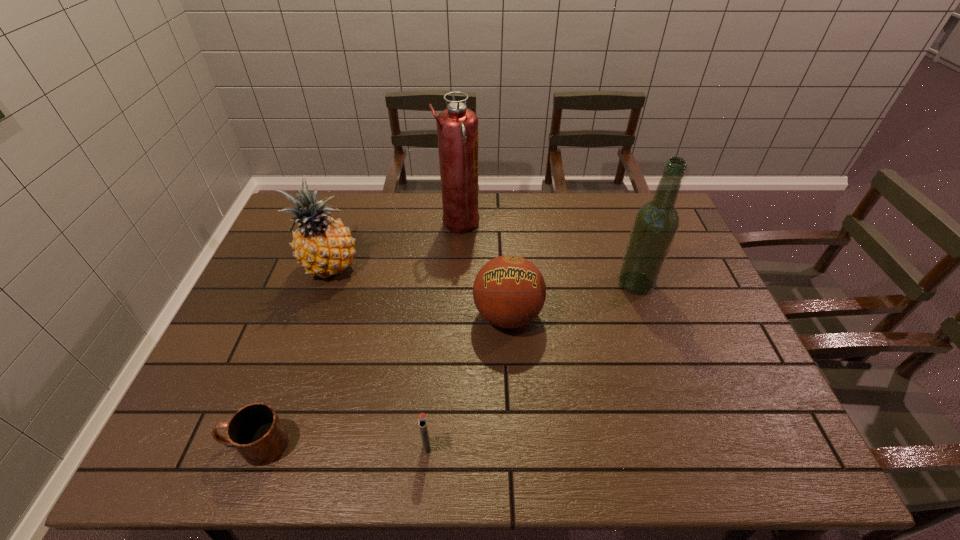
Find the location of a particular element. The height and width of the screenshot is (540, 960). vacant space situated on the left of the igniter is located at coordinates (395, 446).

At what (x,y) coordinates should I click in order to perform the action: click on object situated at the far edge. Please return your answer as a coordinate pair (x, y). Image resolution: width=960 pixels, height=540 pixels. Looking at the image, I should click on (457, 126).

The height and width of the screenshot is (540, 960). I want to click on igniter situated at the near edge, so click(x=422, y=420).

What are the coordinates of `mug that is positioned at the near edge` in the screenshot? It's located at (255, 430).

Identify the location of pineapple situated at the left edge. The image size is (960, 540). (323, 246).

You are a GUI agent. You are given a task and a screenshot of the screen. Output one action in this format:
    pyautogui.click(x=<x>, y=<y>)
    Task: Click on the mug that is at the left edge
    Image resolution: width=960 pixels, height=540 pixels.
    Given the screenshot: What is the action you would take?
    pyautogui.click(x=255, y=430)

I want to click on object that is at the right edge, so click(x=656, y=223).

Locate an element on the screen. object that is at the near left corner is located at coordinates (255, 430).

You are a GUI agent. You are given a task and a screenshot of the screen. Output one action in this format:
    pyautogui.click(x=<x>, y=<y>)
    Task: Click on the vacant area at the far edge
    The width and height of the screenshot is (960, 540).
    Given the screenshot: What is the action you would take?
    pyautogui.click(x=386, y=207)

Image resolution: width=960 pixels, height=540 pixels. I want to click on free space at the near edge, so 575,454.